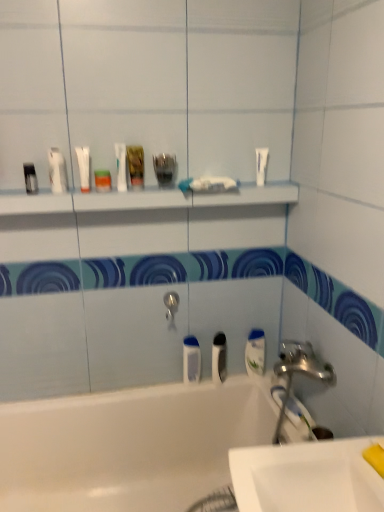
The height and width of the screenshot is (512, 384). I want to click on free space above white glossy shelf at upper center (from a real-world perspective), so click(146, 185).